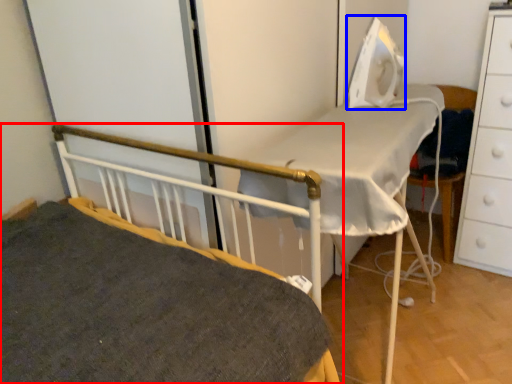
Question: Which object appears closest to the camera in this image, bed (highlighted by a red box) or equipment (highlighted by a blue box)?

Choices:
 (A) bed
 (B) equipment

Answer: (A)